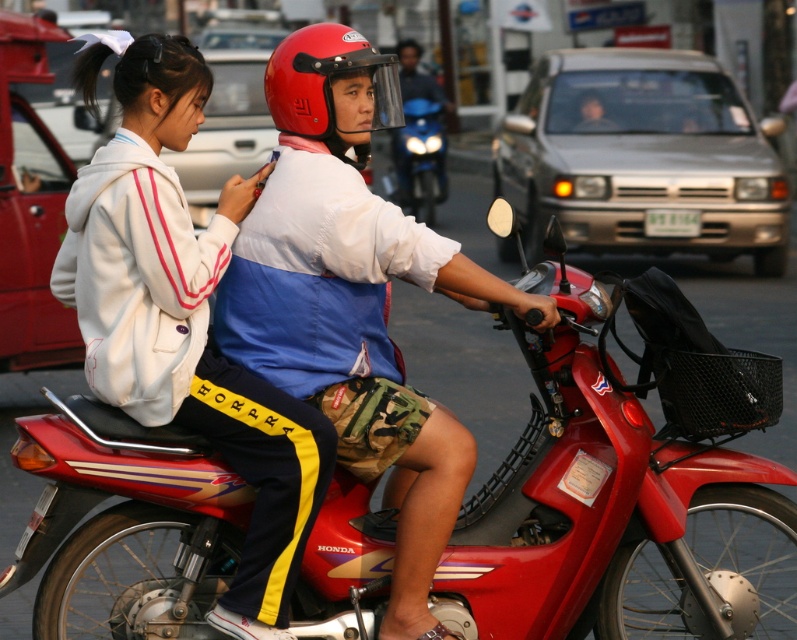
You are a delivery person who needs to secure a package on the metallic red motorcycle at center. The red matte helmet at center is already placed on the rider. Can you fit the package on the motorcycle without removing the helmet?

The metallic red motorcycle at center is taller than the red matte helmet at center, so there should be enough vertical space to place the package on the motorcycle without removing the helmet.

You are a pedestrian standing on the sidewalk and see the matte blue shirt at center and the white fleece jacket at upper left in the scene. Which clothing item is closer to you?

The matte blue shirt at center is closer to you because it is further to the viewer than the white fleece jacket at upper left.